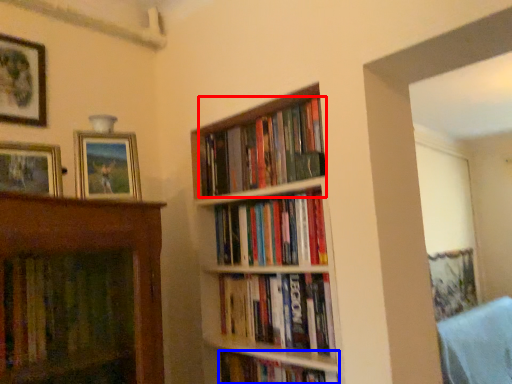
Question: Which object appears closest to the camera in this image, book (highlighted by a red box) or book (highlighted by a blue box)?

Choices:
 (A) book
 (B) book

Answer: (B)